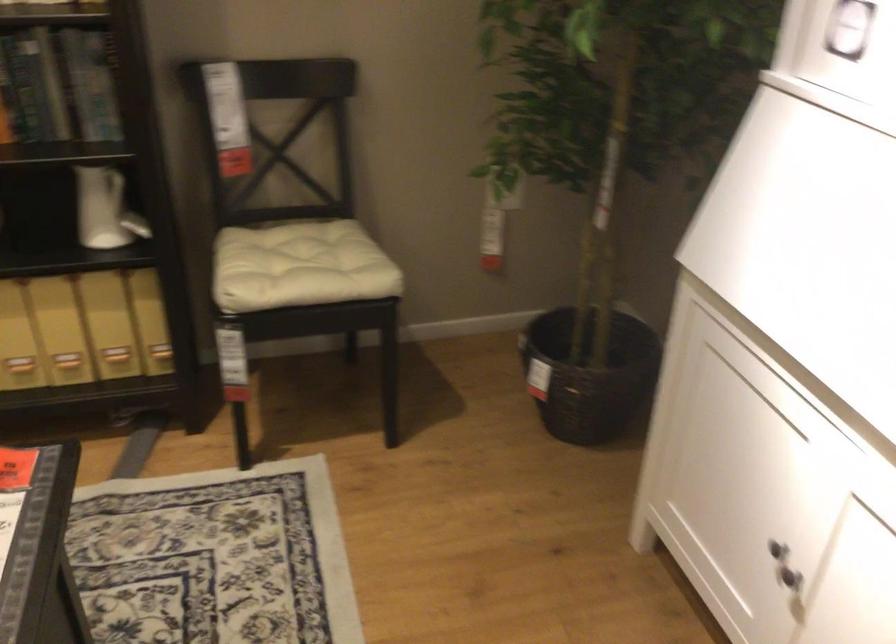
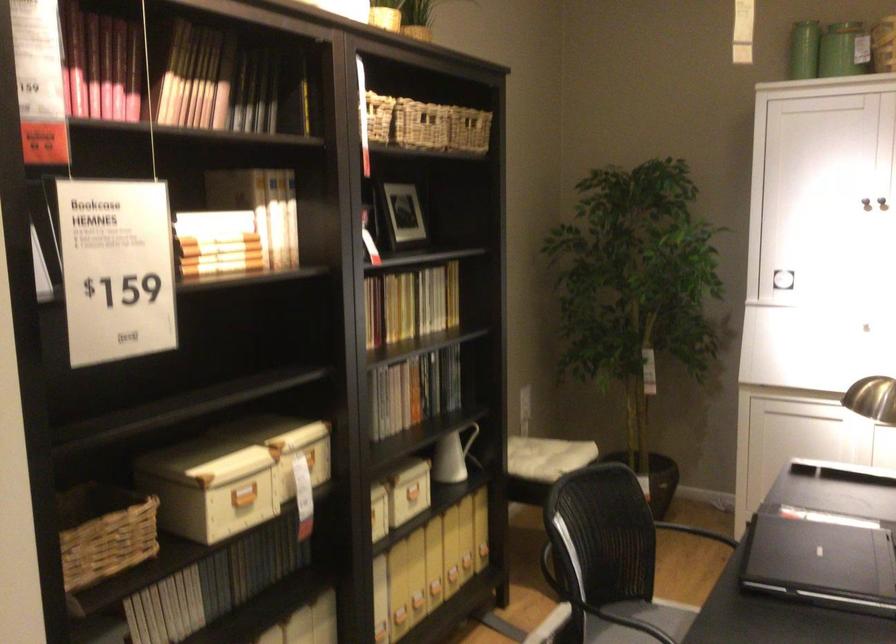
Locate, in the second image, the point that corresponds to (x=621, y=477) in the first image.

(695, 532)